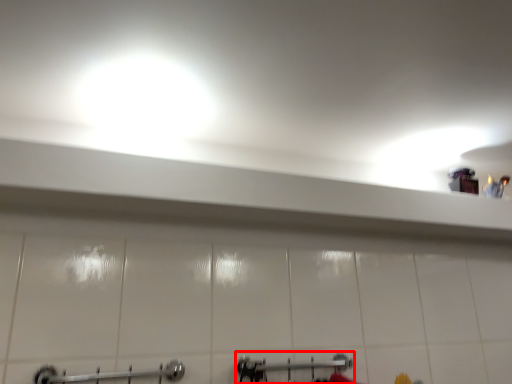
Question: Where is shower (annotated by the red box) located in relation to towel rack in the image?

Choices:
 (A) left
 (B) right

Answer: (B)